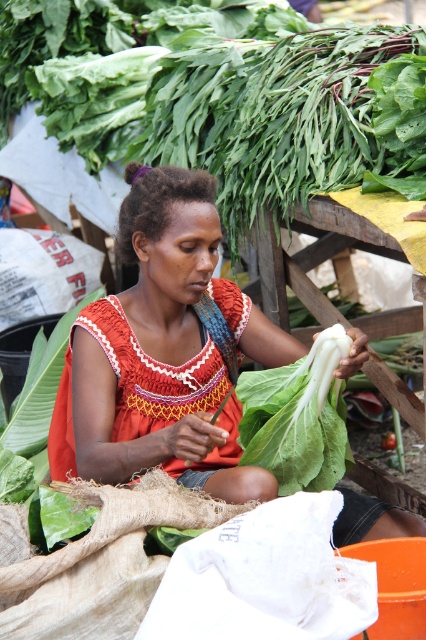
You are a customer at the market stall and want to buy both the green leafy vegetable at upper center and the white leafy green at center. Which one is positioned higher in the image?

The green leafy vegetable at upper center is positioned higher than the white leafy green at center in the image.